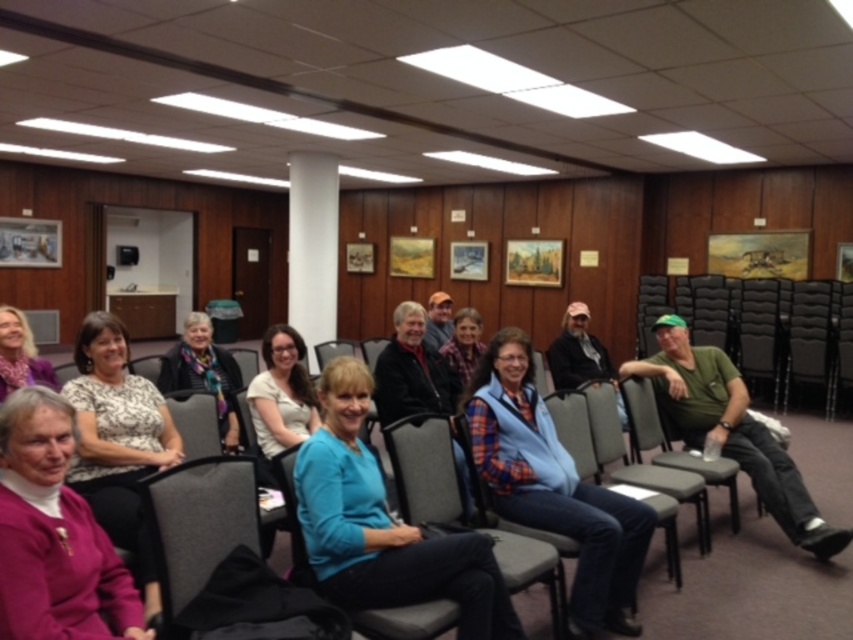
Consider the image. How far apart are purple sweater at lower left and multicolored scarf at center?

purple sweater at lower left and multicolored scarf at center are 5.74 feet apart.

Is purple sweater at lower left above multicolored scarf at center?

Incorrect, purple sweater at lower left is not positioned above multicolored scarf at center.

Is point (38, 394) positioned in front of point (164, 380)?

Yes, point (38, 394) is closer to viewer.

The width and height of the screenshot is (853, 640). Identify the location of purple sweater at lower left. (54, 534).

Can you confirm if purple sweater at lower left is positioned below patterned fabric blouse at center?

No.

Can you confirm if purple sweater at lower left is smaller than patterned fabric blouse at center?

Yes, purple sweater at lower left is smaller than patterned fabric blouse at center.

Where is `purple sweater at lower left`? purple sweater at lower left is located at coordinates (54, 534).

Is blue plaid vest at center taller than matte blue sweater at center?

Yes.

Does blue plaid vest at center appear under matte blue sweater at center?

Yes, blue plaid vest at center is below matte blue sweater at center.

Describe the element at coordinates (554, 486) in the screenshot. I see `blue plaid vest at center` at that location.

Find the location of `blue plaid vest at center`. blue plaid vest at center is located at coordinates (554, 486).